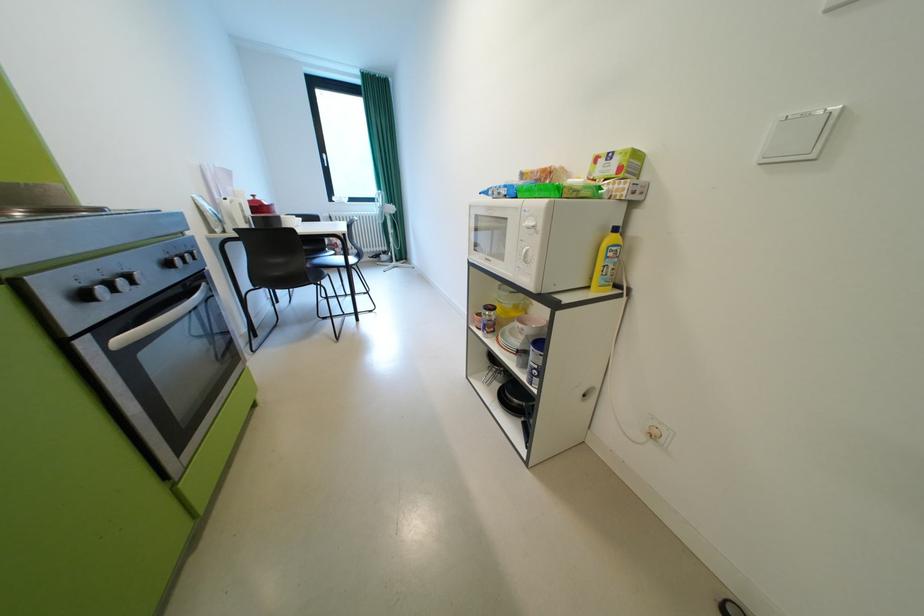
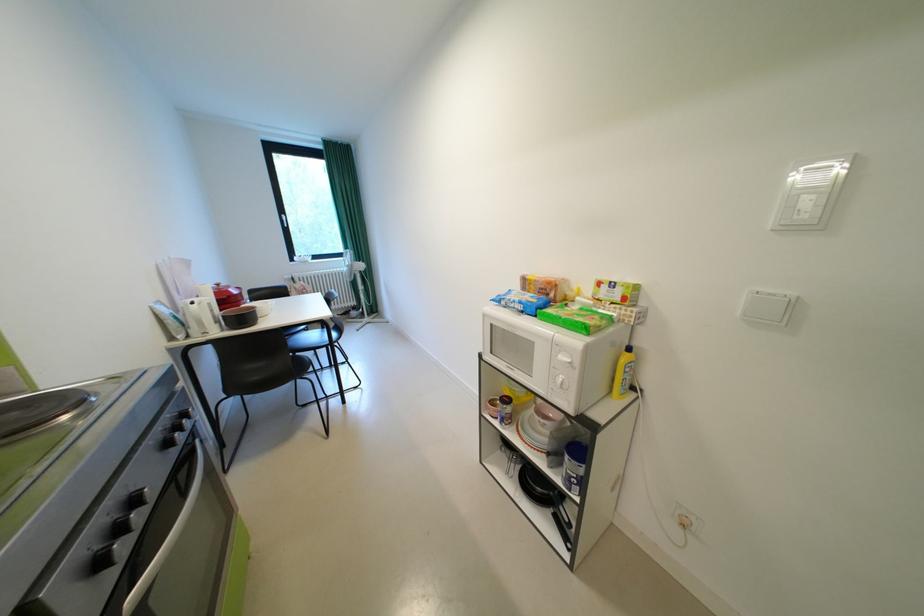
The point at (137, 278) is marked in the first image. Where is the corresponding point in the second image?

(146, 501)